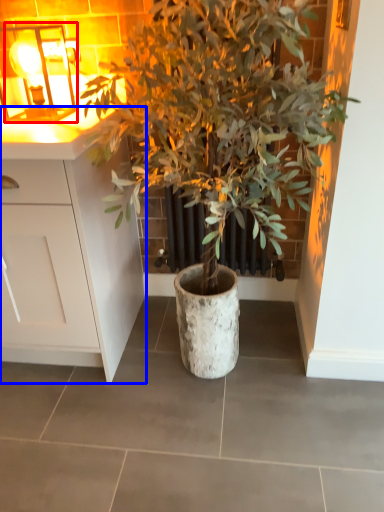
Question: Which point is closer to the camera, light fixture (highlighted by a red box) or cabinetry (highlighted by a blue box)?

Choices:
 (A) light fixture
 (B) cabinetry

Answer: (B)